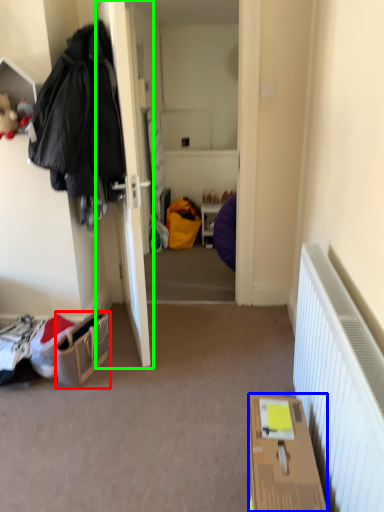
Question: Which object is the farthest from handbag (highlighted by a red box)? Choose among these: box (highlighted by a blue box) or door (highlighted by a green box).

Choices:
 (A) box
 (B) door

Answer: (A)